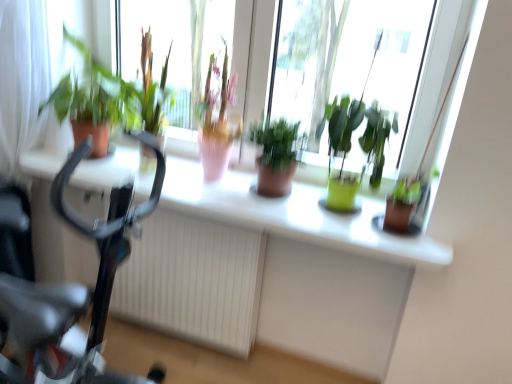
At what (x,y) coordinates should I click in order to perform the action: click on vacant space in matte brown pot at center, marked as the 2th houseplant in a left-to-right arrangement (from a real-world perspective). Please return your answer as a coordinate pair (x, y). The width and height of the screenshot is (512, 384). Looking at the image, I should click on (269, 200).